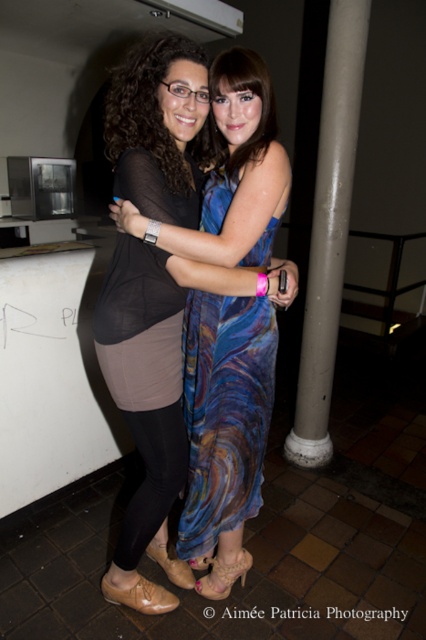
Who is positioned more to the left, swirl fabric dress at center or gray concrete pillar at center?

swirl fabric dress at center

Who is taller, swirl fabric dress at center or gray concrete pillar at center?

gray concrete pillar at center

Is point (201, 372) positioned after point (316, 333)?

No, (201, 372) is in front of (316, 333).

At what (x,y) coordinates should I click in order to perform the action: click on swirl fabric dress at center. Please return your answer as a coordinate pair (x, y). The width and height of the screenshot is (426, 640). Looking at the image, I should click on (224, 412).

How far apart are blue textured dress at center and shiny blue dress at center?

The distance of blue textured dress at center from shiny blue dress at center is 3.96 inches.

From the picture: Which of these two, blue textured dress at center or shiny blue dress at center, stands shorter?

With less height is shiny blue dress at center.

Locate an element on the screen. The image size is (426, 640). blue textured dress at center is located at coordinates (183, 97).

In the scene shown: Who is higher up, gray concrete pillar at center or matte black top at center?

Positioned higher is matte black top at center.

Is point (325, 93) behind point (152, 102)?

Yes, it is.

Where is `gray concrete pillar at center`? The image size is (426, 640). gray concrete pillar at center is located at coordinates (328, 228).